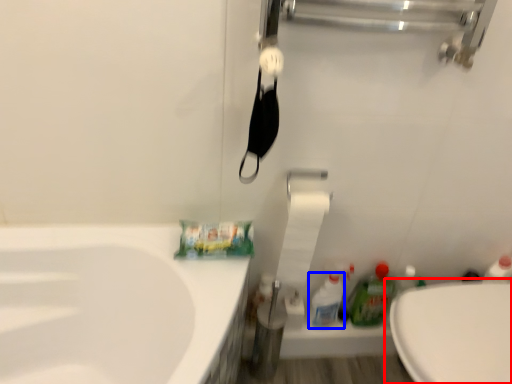
Question: Which object is further to the camera taking this photo, toilet (highlighted by a red box) or cleaning product (highlighted by a blue box)?

Choices:
 (A) toilet
 (B) cleaning product

Answer: (B)